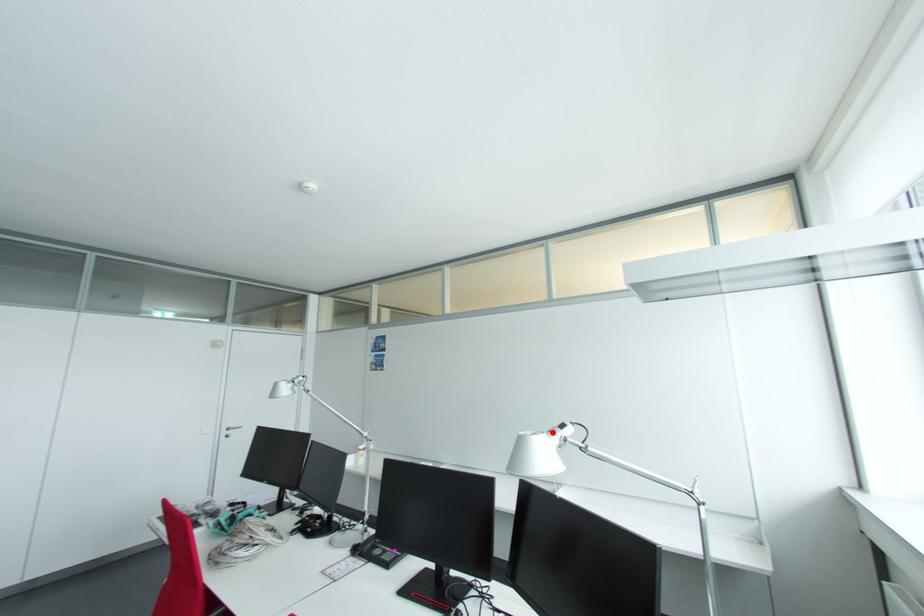
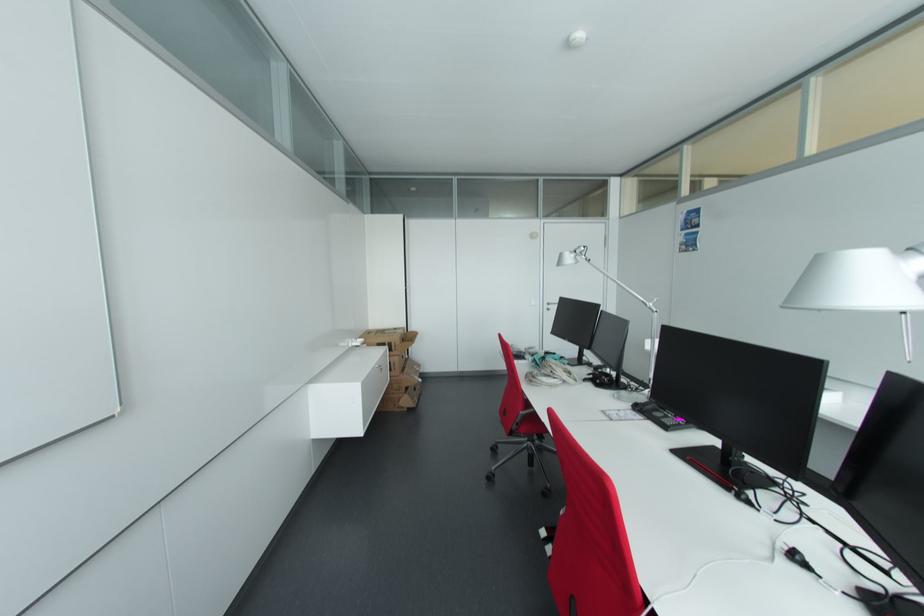
The point at the highlighted location is marked in the first image. Where is the corresponding point in the second image?

(913, 249)